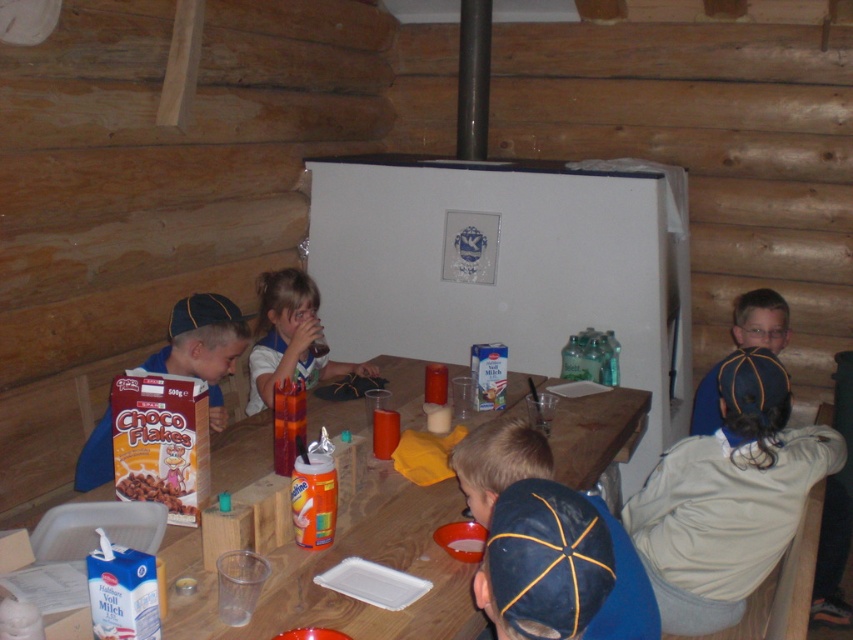
Question: Considering the real-world distances, which object is closest to the light beige jacket at lower right?

Choices:
 (A) matte blue cap at lower right
 (B) matte cardboard cereal box at center left
 (C) translucent plastic cup at center
 (D) matte cardboard cereal box at lower left

Answer: (A)

Question: Among these points, which one is nearest to the camera?

Choices:
 (A) (271, 304)
 (B) (173, 490)

Answer: (B)

Question: Is light beige jacket at lower right to the left of matte cardboard cereal box at lower left from the viewer's perspective?

Choices:
 (A) no
 (B) yes

Answer: (A)

Question: Does light beige jacket at lower right appear on the right side of matte blue cap at lower right?

Choices:
 (A) yes
 (B) no

Answer: (B)

Question: In this image, where is matte blue cap at lower right located relative to translucent plastic cup at center?

Choices:
 (A) above
 (B) below

Answer: (B)

Question: Among these points, which one is nearest to the camera?

Choices:
 (A) (590, 404)
 (B) (80, 456)
 (C) (257, 349)

Answer: (B)